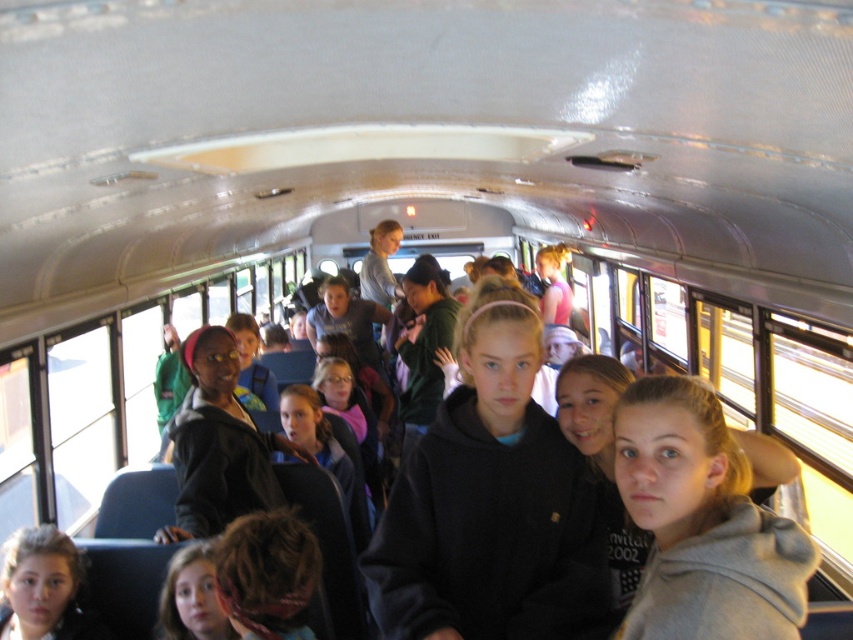
You are a parent trying to locate your child on the school bus. Your child is wearing either the black matte sweatshirt at center or the matte black hoodie at lower left. Which clothing item is positioned closer to the middle of the bus?

The black matte sweatshirt at center is positioned closer to the middle of the bus as it is to the right of the matte black hoodie at lower left.

You are a photographer standing in front of the school bus. You want to take a photo of the black matte sweatshirt at center and the matte black hoodie at lower left. Which one will appear larger in your photo?

The black matte sweatshirt at center will appear larger in the photo because it is closer to the viewer than the matte black hoodie at lower left.

You are a photographer standing in front of the school bus. You want to take a photo of the black matte sweatshirt at center. Where should you position yourself relative to the bus to ensure the sweatshirt is in the center of your photo?

To center the black matte sweatshirt at center in your photo, position yourself directly in front of the bus at the point corresponding to coordinates 0.786 on the horizontal axis and 0.577 on the vertical axis relative to the bus image.